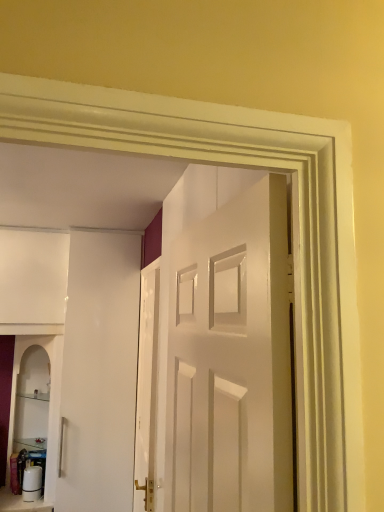
Question: Is white glossy door at center, positioned as the 2th door in front-to-back order, placed right next to white glossy cabinet at lower left?

Choices:
 (A) yes
 (B) no

Answer: (B)

Question: Is white glossy door at center, the 1th door viewed from the left, in front of white glossy cabinet at lower left?

Choices:
 (A) yes
 (B) no

Answer: (A)

Question: Can you confirm if white glossy door at center, positioned as the 2th door in front-to-back order, is shorter than white glossy cabinet at lower left?

Choices:
 (A) no
 (B) yes

Answer: (A)

Question: From a real-world perspective, is white glossy door at center, the 1th door viewed from the left, physically above white glossy cabinet at lower left?

Choices:
 (A) no
 (B) yes

Answer: (B)

Question: Is white glossy door at center, which appears as the 1th door when viewed from the back, far from white glossy cabinet at lower left?

Choices:
 (A) no
 (B) yes

Answer: (A)

Question: Considering the positions of point (13, 364) and point (1, 507), is point (13, 364) closer or farther from the camera than point (1, 507)?

Choices:
 (A) farther
 (B) closer

Answer: (A)

Question: Visually, is white glossy cabinet at lower left positioned to the left or to the right of white glossy water bottle at lower left?

Choices:
 (A) left
 (B) right

Answer: (B)

Question: From the image's perspective, is white glossy cabinet at lower left above or below white glossy water bottle at lower left?

Choices:
 (A) below
 (B) above

Answer: (B)

Question: Looking at their shapes, would you say white glossy cabinet at lower left is wider or thinner than white glossy water bottle at lower left?

Choices:
 (A) wide
 (B) thin

Answer: (B)

Question: Is white glossy door at center, the 1th door viewed from the left, inside or outside of white glossy cabinet at lower left?

Choices:
 (A) inside
 (B) outside

Answer: (B)

Question: From the image's perspective, is white glossy door at center, which appears as the 1th door when viewed from the back, located above or below white glossy cabinet at lower left?

Choices:
 (A) above
 (B) below

Answer: (A)

Question: In the image, is white glossy door at center, which appears as the 1th door when viewed from the back, positioned in front of or behind white glossy cabinet at lower left?

Choices:
 (A) behind
 (B) front

Answer: (B)

Question: Visually, is white glossy door at center, which appears as the 1th door when viewed from the back, positioned to the left or to the right of white glossy cabinet at lower left?

Choices:
 (A) right
 (B) left

Answer: (A)

Question: Based on their positions, is white glossy door at center, which is the 1th door from front to back, located to the left or right of white glossy cabinet at lower left?

Choices:
 (A) right
 (B) left

Answer: (A)

Question: From the image's perspective, is white glossy door at center, positioned as the second door in left-to-right order, above or below white glossy cabinet at lower left?

Choices:
 (A) above
 (B) below

Answer: (A)